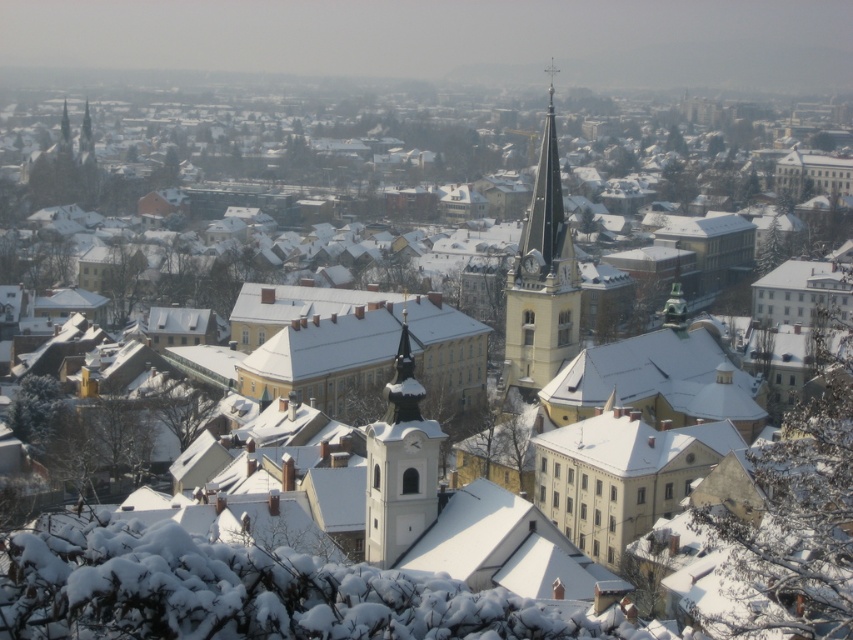
You are an architect analyzing the spatial arrangement of the town. From your vantage point, which of the two structures, the smooth white steeple at center or the white stone clock tower at center, appears closer to you?

The smooth white steeple at center appears closer because it is in front of the white stone clock tower at center.

You are a drone operator tasked with capturing aerial footage of the two towers in the winter scene. The smooth white steeple at center and the white stone clock tower at center are your targets. Your drone has a maximum flight range of 35 meters. Can your drone reach both towers without needing to recharge?

The smooth white steeple at center is 34.73 meters from the white stone clock tower at center. Since the distance between them is within the drone operator drone has a maximum flight range of 35 meters, the drone can reach both towers without needing to recharge.

You are an architect analyzing the winter scene of the European town. You need to determine if the smooth white steeple at center can accommodate a new decorative element that requires a base width of 3 meters. Given the white stone clock tower at center is known to be 2.5 meters wide, can the steeple support the element?

The smooth white steeple at center might be wider than white stone clock tower at center, which is 2.5 meters wide. Therefore, the steeple could potentially accommodate the 3 meter base decorative element if its width meets or exceeds the requirement.